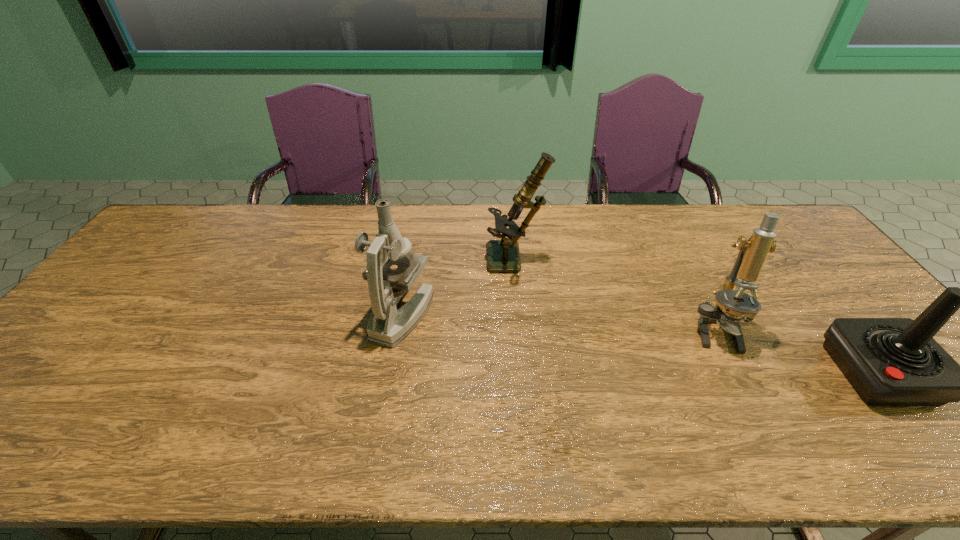
The width and height of the screenshot is (960, 540). What are the coordinates of `empty space that is in between the leftmost object and the rightmost microscope` in the screenshot? It's located at (559, 322).

Identify the location of vacant region between the rightmost object and the third object from left to right. (797, 352).

Locate which object is the second closest to the second microscope from left to right. Please provide its 2D coordinates. Your answer should be formatted as a tuple, i.e. [(x, y)], where the tuple contains the x and y coordinates of a point satisfying the conditions above.

[(727, 313)]

Locate an element on the screen. This screenshot has height=540, width=960. object that is the third closest to the second object from right to left is located at coordinates (388, 325).

Locate which microscope ranks in proximity to the leftmost microscope. Please provide its 2D coordinates. Your answer should be formatted as a tuple, i.e. [(x, y)], where the tuple contains the x and y coordinates of a point satisfying the conditions above.

[(503, 255)]

Select which microscope appears as the second closest to the leftmost microscope. Please provide its 2D coordinates. Your answer should be formatted as a tuple, i.e. [(x, y)], where the tuple contains the x and y coordinates of a point satisfying the conditions above.

[(727, 313)]

The image size is (960, 540). I want to click on vacant area in the image that satisfies the following two spatial constraints: 1. at the eyepiece of the second object from left to right; 2. on the back side of the second object from right to left, so click(x=521, y=330).

This screenshot has width=960, height=540. Find the location of `free space that satisfies the following two spatial constraints: 1. at the eyepiece of the third object from left to right; 2. on the right side of the second microscope from right to left`. free space that satisfies the following two spatial constraints: 1. at the eyepiece of the third object from left to right; 2. on the right side of the second microscope from right to left is located at coordinates (521, 330).

Image resolution: width=960 pixels, height=540 pixels. Identify the location of free region that satisfies the following two spatial constraints: 1. at the eyepiece of the second object from right to left; 2. on the left side of the second object from left to right. (521, 330).